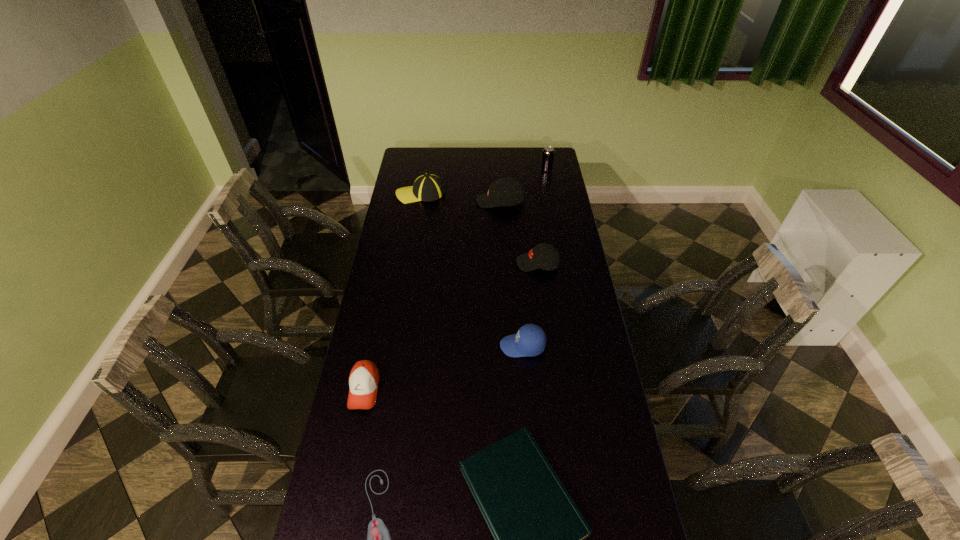
Locate an element on the screen. free area in between the third nearest object and the fifth farthest object is located at coordinates (444, 368).

Point out which object is positioned as the fifth nearest to the fifth nearest object. Please provide its 2D coordinates. Your answer should be formatted as a tuple, i.e. [(x, y)], where the tuple contains the x and y coordinates of a point satisfying the conditions above.

[(364, 378)]

Select which object is the fifth closest to the second nearest baseball cap. Please provide its 2D coordinates. Your answer should be formatted as a tuple, i.e. [(x, y)], where the tuple contains the x and y coordinates of a point satisfying the conditions above.

[(364, 378)]

Locate an element on the screen. baseball cap that stands as the fourth closest to the cap is located at coordinates (427, 187).

In order to click on the fourth closest baseball cap to the fifth farthest object in this screenshot , I will do `click(427, 187)`.

Where is `blank area in the image that satisfies the following two spatial constraints: 1. on the front-facing side of the cap; 2. on the front-facing side of the sixth farthest object`? blank area in the image that satisfies the following two spatial constraints: 1. on the front-facing side of the cap; 2. on the front-facing side of the sixth farthest object is located at coordinates (526, 389).